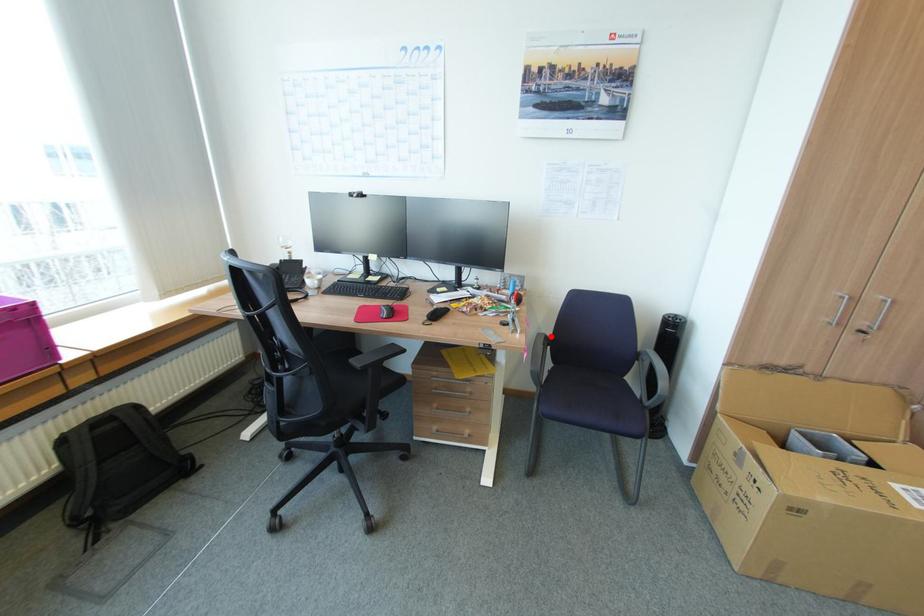
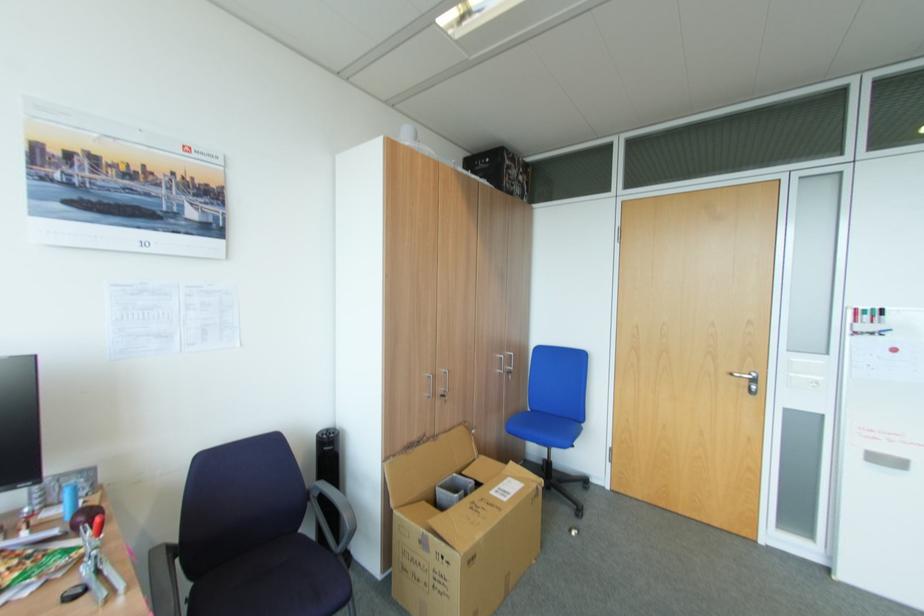
In the second image, find the point that corresponds to the highlighted location in the first image.

(174, 546)